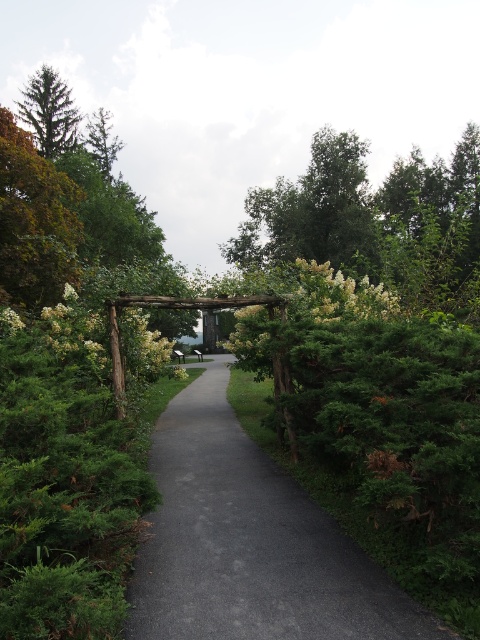
You are standing at the entrance of the garden and see the green leafy tree at upper center and the green matte tree at upper left. Which tree is positioned more to the left side of the garden?

The green matte tree at upper left is positioned more to the left side of the garden than the green leafy tree at upper center.

You are standing at the entrance of the garden and see the green leafy tree at upper center. If you walk straight along the pathway, will you approach closer to the tree or move away from it?

The green leafy tree at upper center is located at point (x=313, y=212), which suggests it is positioned along the pathway. As you walk straight along the pathway, you will approach closer to the tree.